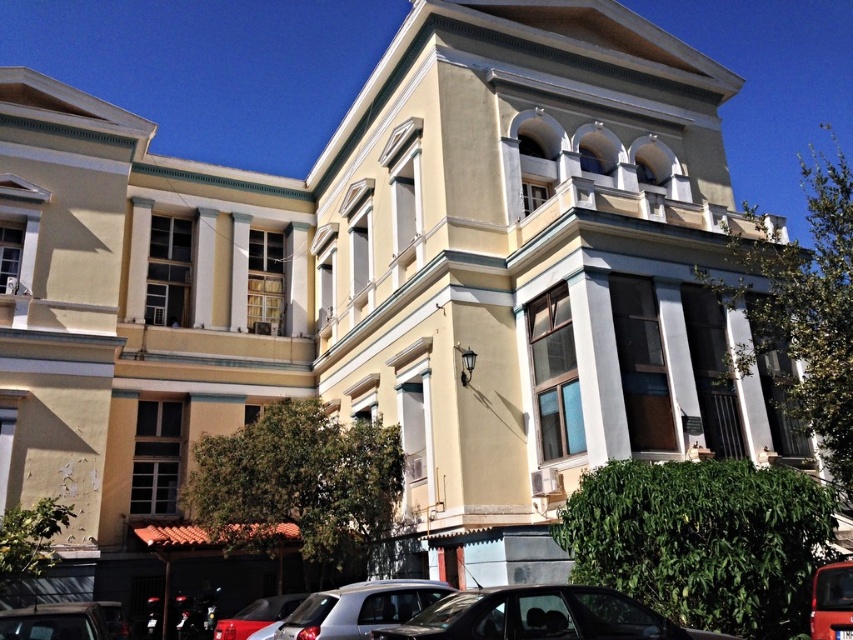
Who is positioned more to the right, silver metallic car at lower center or metallic silver car at lower left?

silver metallic car at lower center is more to the right.

Is silver metallic car at lower center positioned in front of metallic silver car at lower left?

That is False.

Does point (386, 609) lie in front of point (10, 625)?

No, it is not.

You are a GUI agent. You are given a task and a screenshot of the screen. Output one action in this format:
    pyautogui.click(x=<x>, y=<y>)
    Task: Click on the silver metallic car at lower center
    
    Given the screenshot: What is the action you would take?
    pyautogui.click(x=355, y=609)

Is metallic silver car at lower left further to camera compared to matte red bus at lower right?

No, metallic silver car at lower left is closer to the viewer.

Locate an element on the screen. The image size is (853, 640). metallic silver car at lower left is located at coordinates (64, 621).

Image resolution: width=853 pixels, height=640 pixels. What are the coordinates of `metallic silver car at lower left` in the screenshot? It's located at (64, 621).

Which is more to the right, shiny black car at lower right or matte red bus at lower right?

matte red bus at lower right is more to the right.

Which of these two, shiny black car at lower right or matte red bus at lower right, stands taller?

matte red bus at lower right is taller.

In order to click on shiny black car at lower right in this screenshot , I will do `click(540, 616)`.